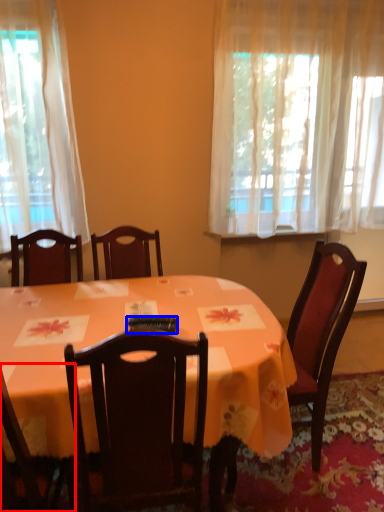
Question: Which object appears closest to the camera in this image, chair (highlighted by a red box) or remote control (highlighted by a blue box)?

Choices:
 (A) chair
 (B) remote control

Answer: (A)